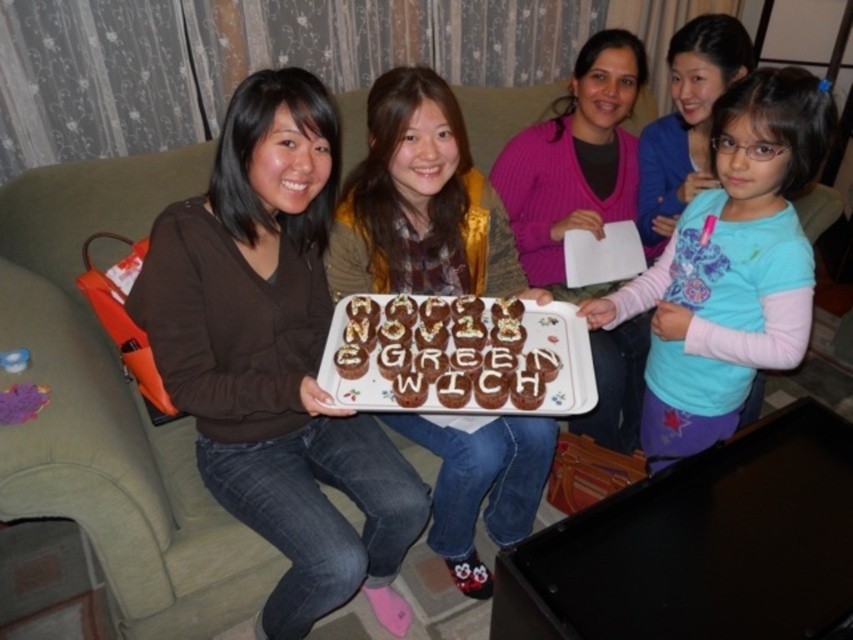
Which is below, pink ribbed sweater at center or chocolatesmoothcake at center?

chocolatesmoothcake at center

Can you confirm if pink ribbed sweater at center is positioned below chocolatesmoothcake at center?

Incorrect, pink ribbed sweater at center is not positioned below chocolatesmoothcake at center.

Image resolution: width=853 pixels, height=640 pixels. What do you see at coordinates (575, 161) in the screenshot?
I see `pink ribbed sweater at center` at bounding box center [575, 161].

Identify the location of pink ribbed sweater at center. Image resolution: width=853 pixels, height=640 pixels. (575, 161).

Which of these two, blue cotton shirt at center or blue cotton shirt at upper right, stands shorter?

blue cotton shirt at upper right

Is point (727, 163) behind point (718, 60)?

No, (727, 163) is closer to viewer.

Does point (730, 374) lie in front of point (680, 108)?

Yes, point (730, 374) is closer to viewer.

Where is `blue cotton shirt at center`? The height and width of the screenshot is (640, 853). blue cotton shirt at center is located at coordinates click(x=730, y=268).

Does matte brown sweater at center have a lesser width compared to chocolatesmoothcake at center?

Yes.

Who is more distant from viewer, (502, 532) or (338, 394)?

Positioned behind is point (502, 532).

This screenshot has height=640, width=853. Identify the location of matte brown sweater at center. (421, 202).